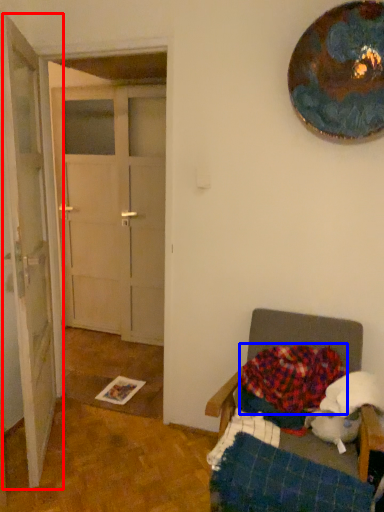
Question: Which object is closer to the camera taking this photo, door (highlighted by a red box) or blanket (highlighted by a blue box)?

Choices:
 (A) door
 (B) blanket

Answer: (A)